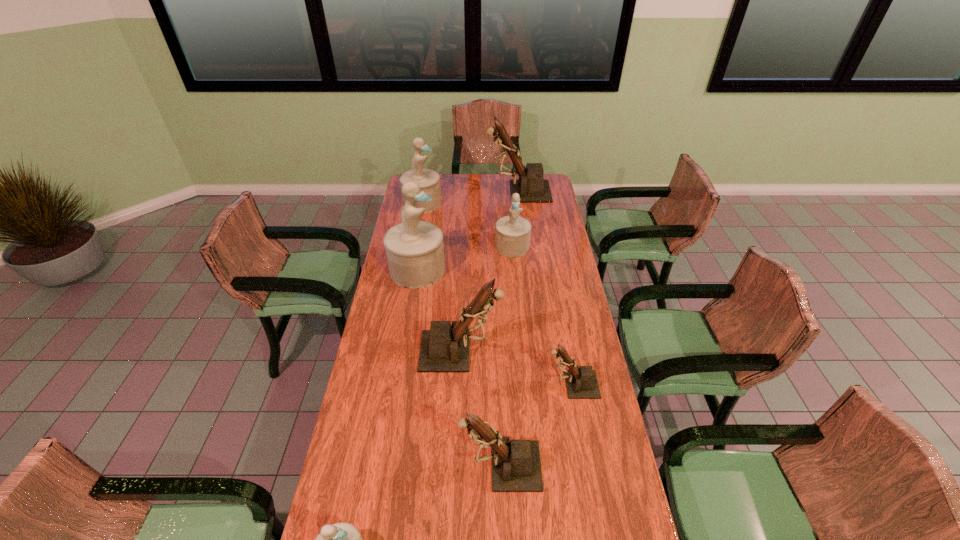
Where is `object that stands as the closest to the rightmost white figurine`? object that stands as the closest to the rightmost white figurine is located at coordinates (415, 251).

Identify which object is the fourth closest to the third biggest white figurine. Please provide its 2D coordinates. Your answer should be formatted as a tuple, i.e. [(x, y)], where the tuple contains the x and y coordinates of a point satisfying the conditions above.

[(444, 348)]

Locate which figurine is the seventh closest to the third biggest brown figurine. Please provide its 2D coordinates. Your answer should be formatted as a tuple, i.e. [(x, y)], where the tuple contains the x and y coordinates of a point satisfying the conditions above.

[(531, 186)]

Where is `figurine that is the seventh closest to the nearest white figurine`? figurine that is the seventh closest to the nearest white figurine is located at coordinates (531, 186).

Image resolution: width=960 pixels, height=540 pixels. Identify the location of the closest brown figurine to the third smallest brown figurine. (581, 383).

Where is `brown figurine object that ranks as the closest to the biggest white figurine`? Image resolution: width=960 pixels, height=540 pixels. brown figurine object that ranks as the closest to the biggest white figurine is located at coordinates (444, 348).

Find the location of a particular element. The width and height of the screenshot is (960, 540). the fourth closest white figurine relative to the third biggest brown figurine is located at coordinates (429, 180).

Locate which white figurine ranks second in proximity to the farthest white figurine. Please provide its 2D coordinates. Your answer should be formatted as a tuple, i.e. [(x, y)], where the tuple contains the x and y coordinates of a point satisfying the conditions above.

[(512, 233)]

This screenshot has height=540, width=960. Find the location of `free location that satisfies the following two spatial constraints: 1. at the beak of the rightmost white figurine; 2. on the front-facing side of the third smallest brown figurine`. free location that satisfies the following two spatial constraints: 1. at the beak of the rightmost white figurine; 2. on the front-facing side of the third smallest brown figurine is located at coordinates (521, 351).